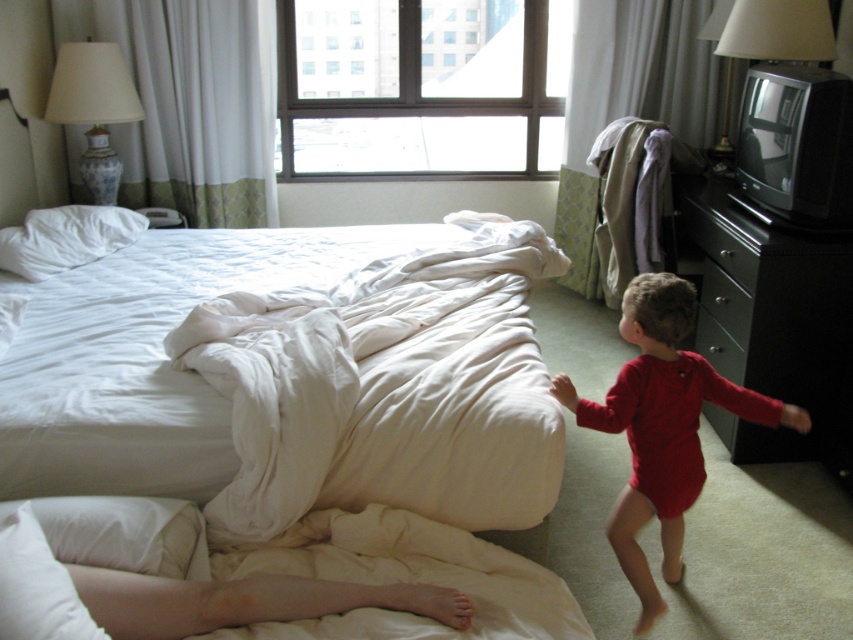
You are organizing the bedroom and need to place a new decorative item between the white soft pillow at lower left and the black glossy drawer at right. Based on their positions, which object should the decorative item be closer to?

The white soft pillow at lower left is in front of the black glossy drawer at right, so the decorative item should be placed closer to the black glossy drawer at right to maintain spatial harmony.

You are a parent in the bedroom looking for your child. You see the red smooth onesie at right and the porcelain lampshade at upper left. Which object is closer to the camera?

The red smooth onesie at right is positioned under the porcelain lampshade at upper left, so the onesie is closer to the camera than the lampshade.